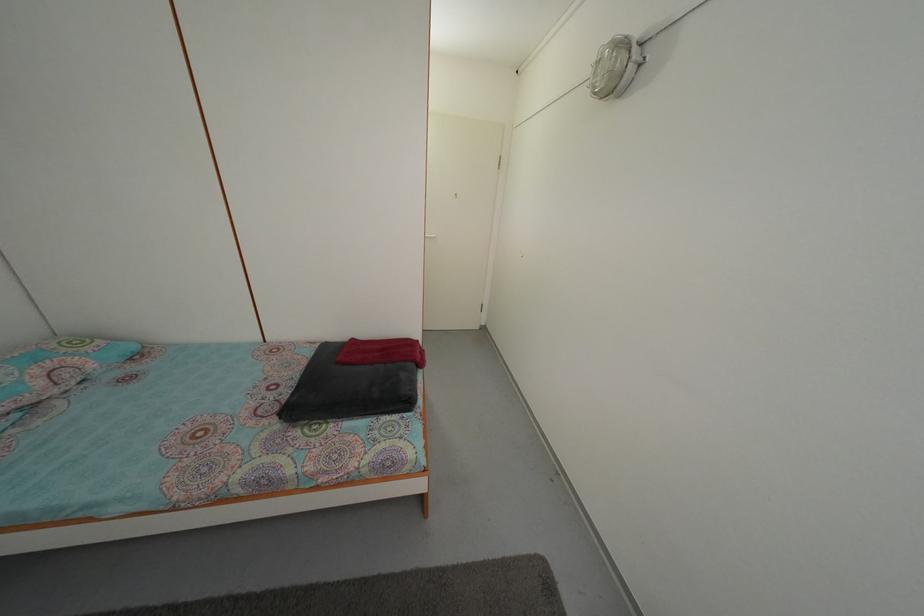
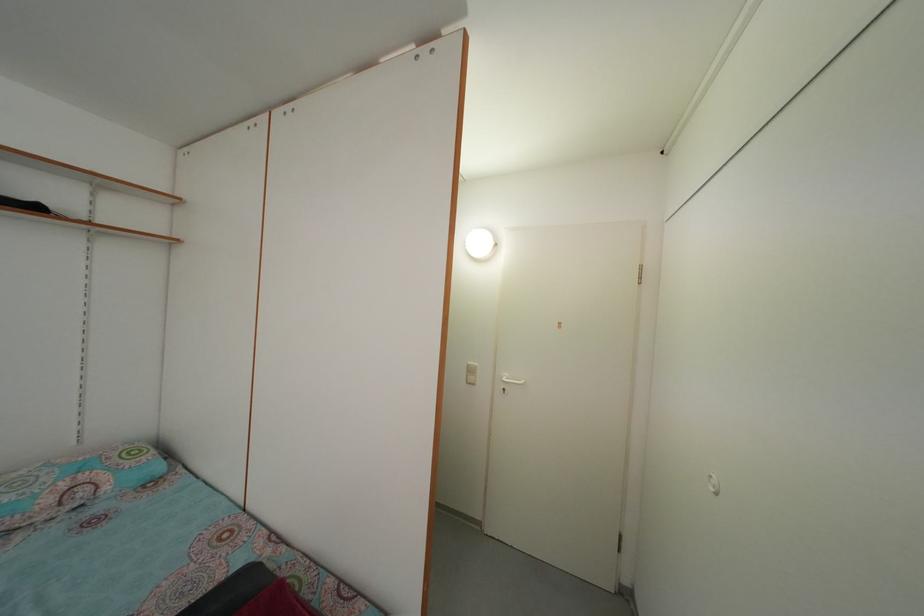
How did the camera likely rotate?

The rotation direction of the camera is left-up.